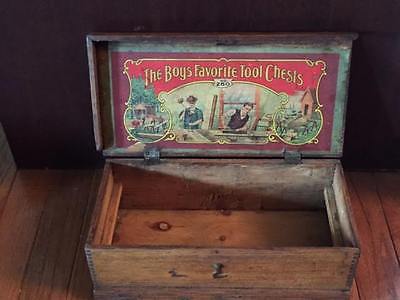
Locate an element on the screen. The width and height of the screenshot is (400, 300). wall is located at coordinates (60, 106).